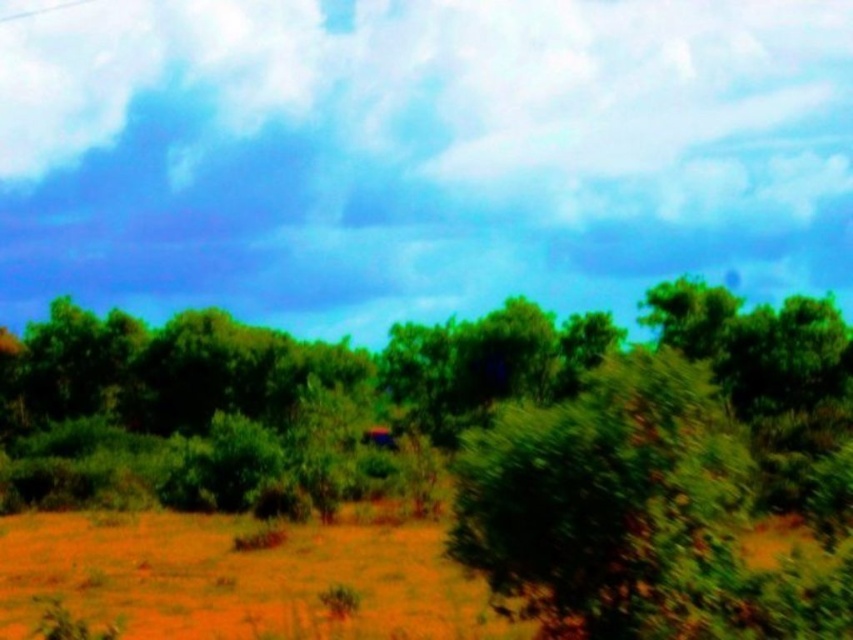
Question: Which point is farther to the camera?

Choices:
 (A) brown sandy dirt field at lower left
 (B) green leafy tree at center

Answer: (A)

Question: Among these points, which one is farthest from the camera?

Choices:
 (A) (450, 563)
 (B) (628, 353)

Answer: (A)

Question: Can you confirm if green leafy tree at center is positioned below brown sandy dirt field at lower left?

Choices:
 (A) no
 (B) yes

Answer: (A)

Question: Which point is closer to the camera?

Choices:
 (A) green leafy tree at center
 (B) brown sandy dirt field at lower left

Answer: (A)

Question: Can you confirm if green leafy tree at center is positioned to the left of brown sandy dirt field at lower left?

Choices:
 (A) yes
 (B) no

Answer: (B)

Question: Does green leafy tree at center have a greater width compared to brown sandy dirt field at lower left?

Choices:
 (A) yes
 (B) no

Answer: (A)